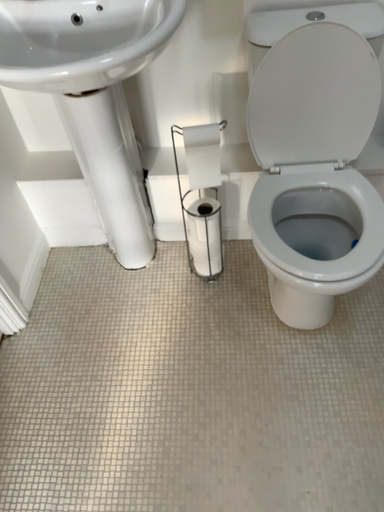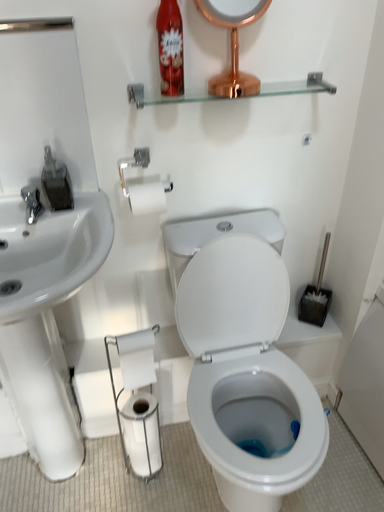
Question: Which way did the camera rotate in the video?

Choices:
 (A) rotated left
 (B) rotated right

Answer: (B)